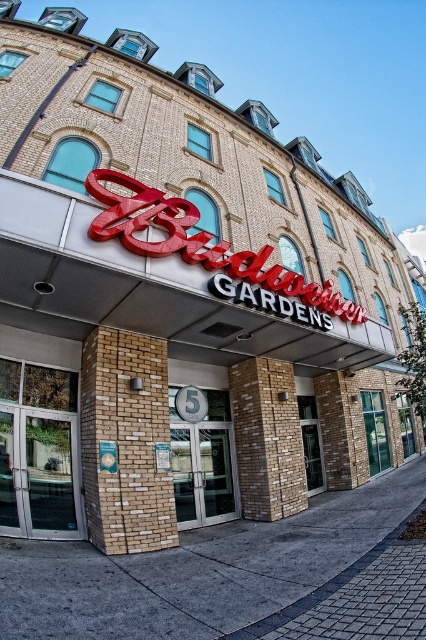
Question: Which point appears farthest from the camera in this image?

Choices:
 (A) (193, 456)
 (B) (9, 433)

Answer: (A)

Question: Which point is farther to the camera?

Choices:
 (A) silver metallic doors at center
 (B) clear glass door at center

Answer: (A)

Question: Among these objects, which one is nearest to the camera?

Choices:
 (A) silver metallic doors at center
 (B) clear glass door at center

Answer: (B)

Question: Does clear glass door at center have a lesser width compared to silver metallic doors at center?

Choices:
 (A) no
 (B) yes

Answer: (B)

Question: Is clear glass door at center to the left of silver metallic doors at center from the viewer's perspective?

Choices:
 (A) no
 (B) yes

Answer: (B)

Question: Is the position of clear glass door at center more distant than that of silver metallic doors at center?

Choices:
 (A) yes
 (B) no

Answer: (B)